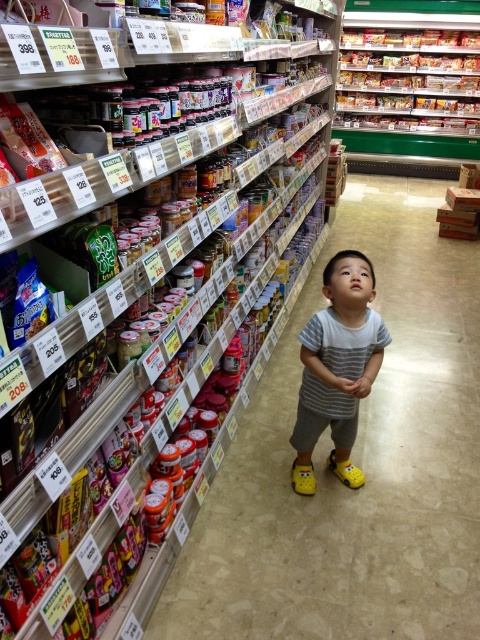
From the picture: You are a parent trying to grab a snack for your child. The child is wearing a striped cotton shirt at center and is looking up at the metallic silver snack at upper right. Can you tell me the position of the snack relative to the child?

The metallic silver snack at upper right is to the right of the striped cotton shirt at center, so the snack is located to the right side of the child.

You are a parent in the grocery store aisle. Your child is wearing a striped cotton shirt at center and is trying to reach the metallic silver snack at upper right. Can you tell me if the snack is taller than the shirt?

The metallic silver snack at upper right is much taller than the striped cotton shirt at center, so yes, the snack is taller than the shirt.